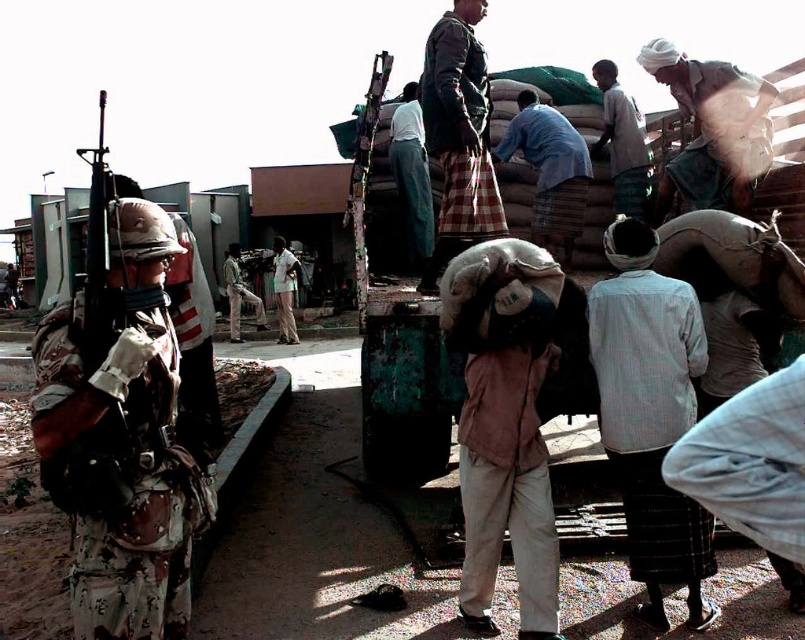
Is point (110, 632) positioned before point (230, 320)?

That is True.

Is camouflage fabric uniform at left in front of camouflage uniform at center?

Yes, camouflage fabric uniform at left is closer to the viewer.

Where is `camouflage fabric uniform at left`? Image resolution: width=805 pixels, height=640 pixels. camouflage fabric uniform at left is located at coordinates (122, 438).

Locate an element on the screen. This screenshot has width=805, height=640. camouflage fabric uniform at left is located at coordinates (122, 438).

Which of these two, camouflage fabric uniform at left or light blue striped shirt at center, stands shorter?

camouflage fabric uniform at left is shorter.

Does camouflage fabric uniform at left have a greater width compared to light blue striped shirt at center?

In fact, camouflage fabric uniform at left might be narrower than light blue striped shirt at center.

Is point (193, 460) positioned before point (628, 496)?

That is True.

Locate an element on the screen. The width and height of the screenshot is (805, 640). camouflage fabric uniform at left is located at coordinates (122, 438).

Who is more distant from viewer, (609, 136) or (259, 304)?

The point (259, 304) is behind.

Can you confirm if green plaid shirt at upper right is positioned below camouflage uniform at center?

No, green plaid shirt at upper right is not below camouflage uniform at center.

Locate an element on the screen. This screenshot has width=805, height=640. green plaid shirt at upper right is located at coordinates (622, 141).